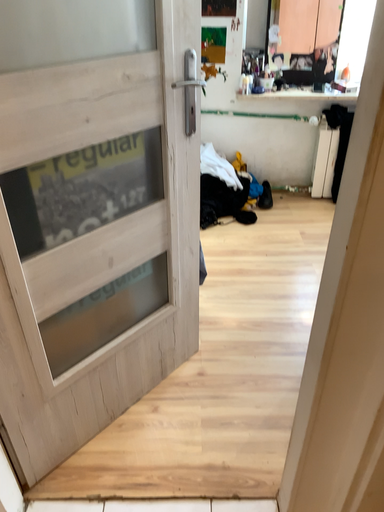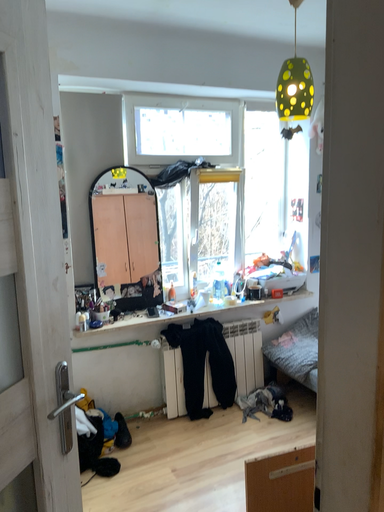
Question: How did the camera likely rotate when shooting the video?

Choices:
 (A) rotated left
 (B) rotated right

Answer: (B)